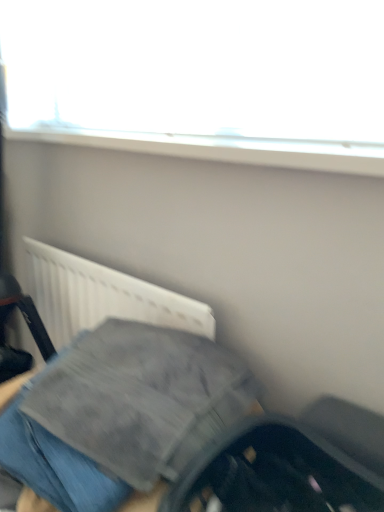
Locate an element on the screen. The width and height of the screenshot is (384, 512). textured gray fabric at lower center is located at coordinates (168, 431).

The image size is (384, 512). Describe the element at coordinates (168, 431) in the screenshot. I see `textured gray fabric at lower center` at that location.

Locate an element on the screen. The height and width of the screenshot is (512, 384). textured gray fabric at lower center is located at coordinates pos(168,431).